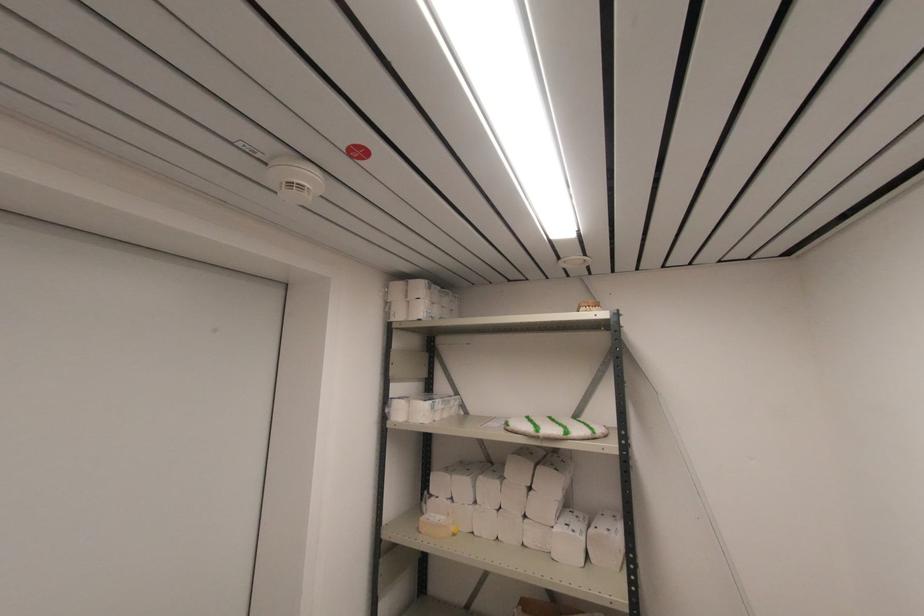
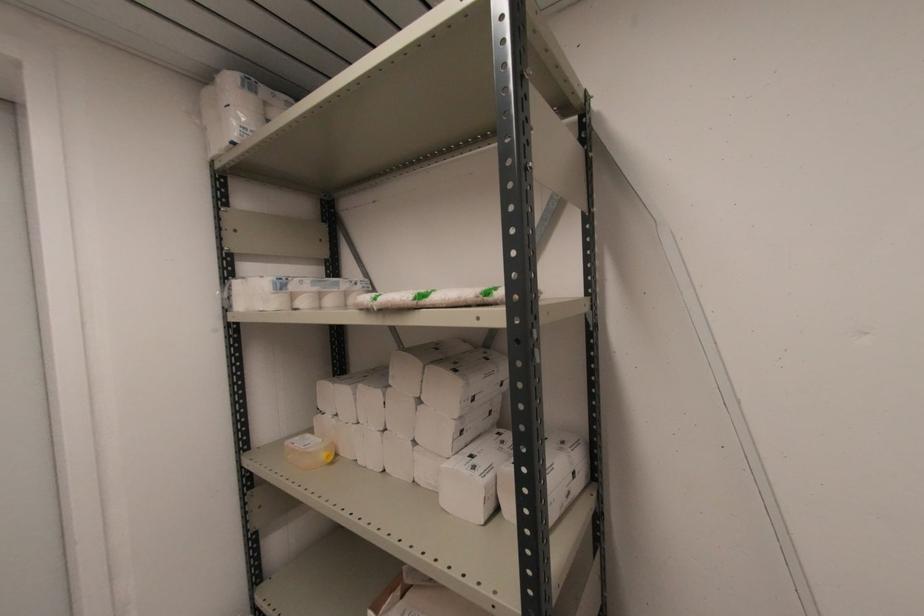
In the second image, find the point that corresponds to point 417,320 in the first image.

(227, 144)